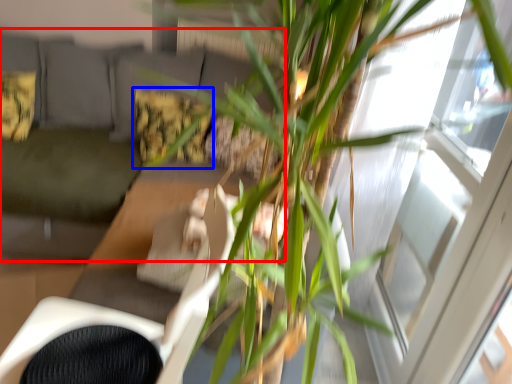
Question: Which object appears closest to the camera in this image, couch (highlighted by a red box) or pillow (highlighted by a blue box)?

Choices:
 (A) couch
 (B) pillow

Answer: (A)